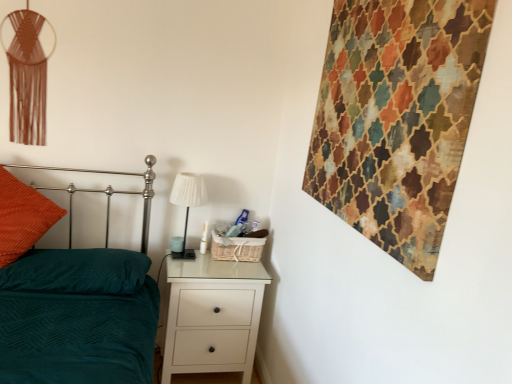
Question: Based on their sizes in the image, would you say orange textured pillow at left is bigger or smaller than teal fabric bed at left?

Choices:
 (A) small
 (B) big

Answer: (A)

Question: Is point (58, 208) closer or farther from the camera than point (74, 336)?

Choices:
 (A) farther
 (B) closer

Answer: (A)

Question: Which object is the closest to the white glossy chest of drawers at lower center?

Choices:
 (A) textured multicolored tapestry at upper right
 (B) white fabric lampshade at center
 (C) teal fabric pillow at lower left
 (D) orange textured pillow at left
 (E) teal fabric bed at left

Answer: (B)

Question: Which object is positioned closest to the white glossy chest of drawers at lower center?

Choices:
 (A) teal fabric bed at left
 (B) textured multicolored tapestry at upper right
 (C) orange textured pillow at left
 (D) teal fabric pillow at lower left
 (E) white fabric lampshade at center

Answer: (E)